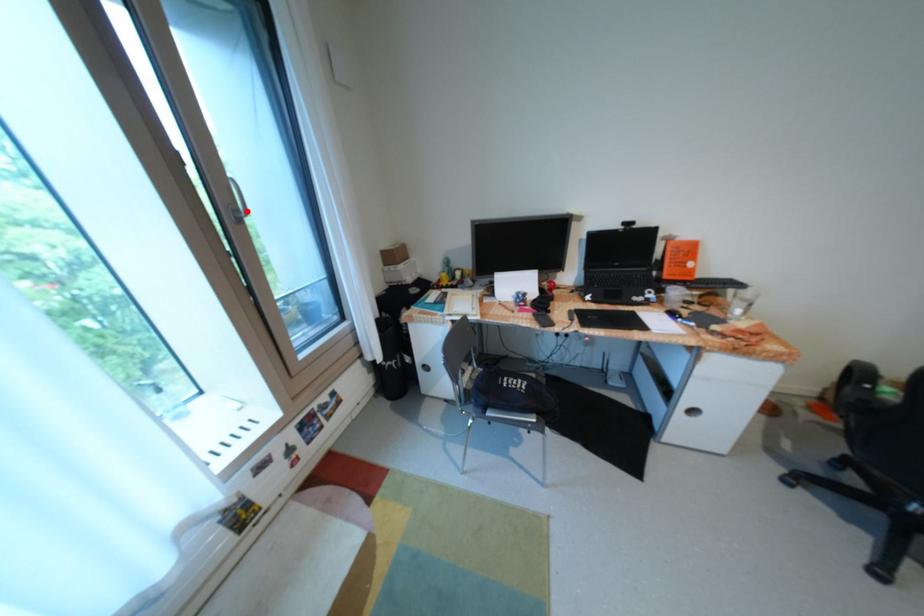
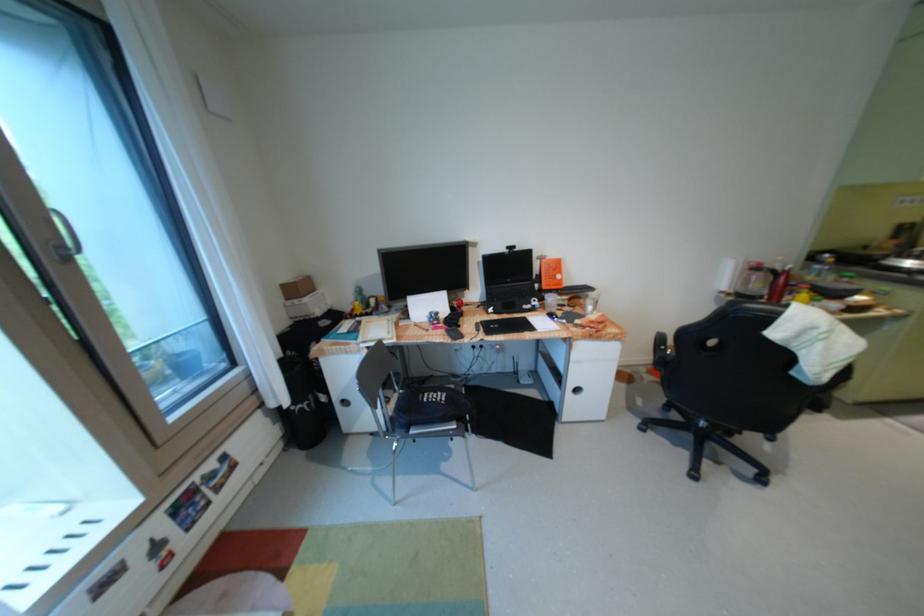
The point at the highlighted location is marked in the first image. Where is the corresponding point in the second image?

(73, 248)